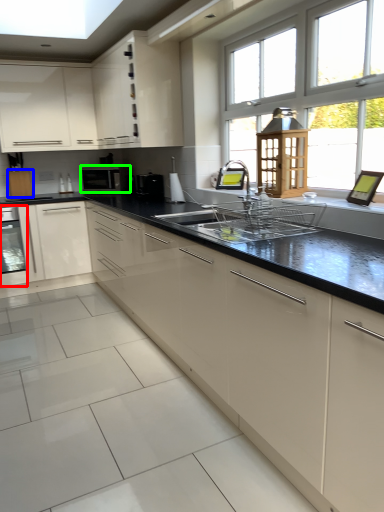
Question: Estimate the real-world distances between objects in this image. Which object is closer to home appliance (highlighted by a red box), cabinetry (highlighted by a blue box) or kitchen appliance (highlighted by a green box)?

Choices:
 (A) cabinetry
 (B) kitchen appliance

Answer: (A)